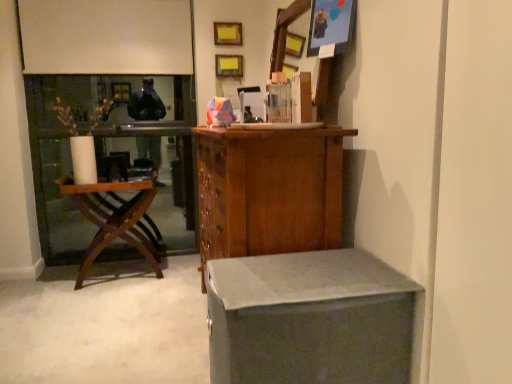
Question: Considering the relative positions of wooden cabinet at center and matte wooden picture frame at upper right, the first picture frame in the bottom-to-top sequence, in the image provided, is wooden cabinet at center to the left of matte wooden picture frame at upper right, the first picture frame in the bottom-to-top sequence, from the viewer's perspective?

Choices:
 (A) yes
 (B) no

Answer: (A)

Question: Is matte wooden picture frame at upper right, which is the first picture frame from right to left, inside wooden cabinet at center?

Choices:
 (A) yes
 (B) no

Answer: (B)

Question: From the image's perspective, does wooden cabinet at center appear higher than matte wooden picture frame at upper right, which is the first picture frame from right to left?

Choices:
 (A) yes
 (B) no

Answer: (B)

Question: Considering the relative sizes of wooden cabinet at center and matte wooden picture frame at upper right, the third picture frame when ordered from left to right, in the image provided, is wooden cabinet at center thinner than matte wooden picture frame at upper right, the third picture frame when ordered from left to right,?

Choices:
 (A) yes
 (B) no

Answer: (B)

Question: Can you confirm if wooden cabinet at center is smaller than matte wooden picture frame at upper right, which is the 1th picture frame from front to back?

Choices:
 (A) no
 (B) yes

Answer: (A)

Question: From the image's perspective, is wooden picture frame at upper center, which is the 3th picture frame in front-to-back order, positioned above or below woodenchair at left?

Choices:
 (A) above
 (B) below

Answer: (A)

Question: Considering the positions of point (224, 66) and point (151, 200), is point (224, 66) closer or farther from the camera than point (151, 200)?

Choices:
 (A) closer
 (B) farther

Answer: (A)

Question: From a real-world perspective, is wooden picture frame at upper center, the 1th picture frame from the back, above or below woodenchair at left?

Choices:
 (A) above
 (B) below

Answer: (A)

Question: Considering the positions of wooden picture frame at upper center, the 2th picture frame when ordered from left to right, and woodenchair at left in the image, is wooden picture frame at upper center, the 2th picture frame when ordered from left to right, taller or shorter than woodenchair at left?

Choices:
 (A) short
 (B) tall

Answer: (A)

Question: Is woodenchair at left bigger or smaller than matte gray desk at lower right?

Choices:
 (A) big
 (B) small

Answer: (A)

Question: From the image's perspective, is woodenchair at left located above or below matte gray desk at lower right?

Choices:
 (A) above
 (B) below

Answer: (A)

Question: In the image, is woodenchair at left on the left side or the right side of matte gray desk at lower right?

Choices:
 (A) right
 (B) left

Answer: (B)

Question: Is woodenchair at left taller or shorter than matte gray desk at lower right?

Choices:
 (A) short
 (B) tall

Answer: (B)

Question: Is wooden picture frame at upper center, the 2th picture frame when ordered from right to left, situated inside matte wooden picture frame at upper right, the third picture frame when ordered from left to right, or outside?

Choices:
 (A) inside
 (B) outside

Answer: (B)

Question: In terms of height, does wooden picture frame at upper center, positioned as the second picture frame in bottom-to-top order, look taller or shorter compared to matte wooden picture frame at upper right, the first picture frame in the bottom-to-top sequence?

Choices:
 (A) tall
 (B) short

Answer: (B)